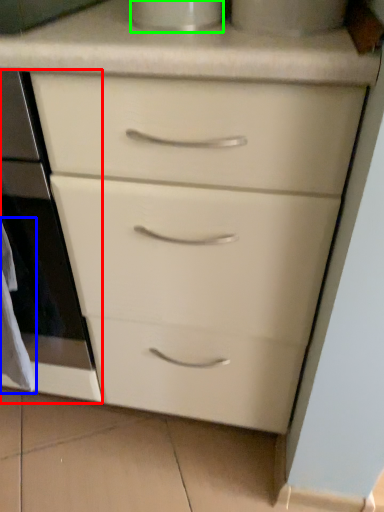
Question: Which object is positioned farthest from oven (highlighted by a red box)? Select from material (highlighted by a blue box) and appliance (highlighted by a green box).

Choices:
 (A) material
 (B) appliance

Answer: (B)